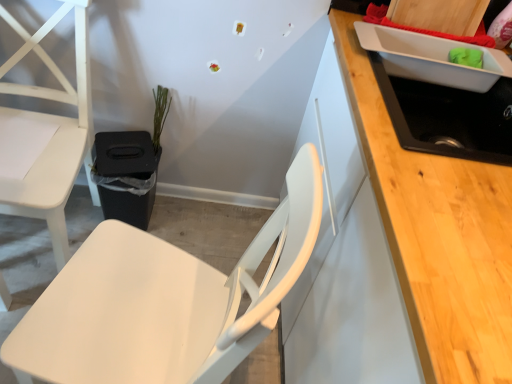
Find the location of a particular element. The image size is (512, 384). white matte chair at left, which is counted as the first chair, starting from the left is located at coordinates 53,136.

What do you see at coordinates (164, 301) in the screenshot? I see `matte white chair at center, acting as the 2th chair starting from the left` at bounding box center [164, 301].

The height and width of the screenshot is (384, 512). What do you see at coordinates (160, 114) in the screenshot? I see `green matte plant at center` at bounding box center [160, 114].

I want to click on white matte chair at left, the second chair positioned from the right, so click(53, 136).

From the image's perspective, is matte white chair at center, acting as the 2th chair starting from the left, positioned above or below white matte chair at left, the second chair positioned from the right?

Clearly, from the image's perspective, matte white chair at center, acting as the 2th chair starting from the left, is below white matte chair at left, the second chair positioned from the right.

Is matte white chair at center, acting as the 2th chair starting from the left, oriented away from white matte chair at left, the second chair positioned from the right?

That's not correct — matte white chair at center, acting as the 2th chair starting from the left, is not looking away from white matte chair at left, the second chair positioned from the right.

Considering the relative positions of matte white chair at center, which is counted as the 1th chair, starting from the right, and white matte chair at left, the second chair positioned from the right, in the image provided, is matte white chair at center, which is counted as the 1th chair, starting from the right, to the left of white matte chair at left, the second chair positioned from the right, from the viewer's perspective?

In fact, matte white chair at center, which is counted as the 1th chair, starting from the right, is to the right of white matte chair at left, the second chair positioned from the right.

Is matte white chair at center, acting as the 2th chair starting from the left, directly adjacent to white matte chair at left, which is counted as the first chair, starting from the left?

No, matte white chair at center, acting as the 2th chair starting from the left, is not with white matte chair at left, which is counted as the first chair, starting from the left.

Considering the points (16, 93) and (129, 364), which point is behind, point (16, 93) or point (129, 364)?

The point (16, 93) is more distant.

From the image's perspective, who appears lower, white matte chair at left, the second chair positioned from the right, or matte white chair at center, acting as the 2th chair starting from the left?

matte white chair at center, acting as the 2th chair starting from the left, from the image's perspective.

Is white matte chair at left, the second chair positioned from the right, further to the viewer compared to matte white chair at center, acting as the 2th chair starting from the left?

Yes, white matte chair at left, the second chair positioned from the right, is further from the camera.

The width and height of the screenshot is (512, 384). What are the coordinates of `sink above the green matte plant at center (from a real-world perspective)` in the screenshot? It's located at (440, 95).

Does black matte sink at upper right have a larger size compared to green matte plant at center?

Indeed, black matte sink at upper right has a larger size compared to green matte plant at center.

Which is in front, black matte sink at upper right or green matte plant at center?

black matte sink at upper right is closer to the camera.

From the image's perspective, is black matte sink at upper right located beneath green matte plant at center?

Yes, from the image's perspective, black matte sink at upper right is beneath green matte plant at center.

Is matte white chair at center, acting as the 2th chair starting from the left, placed right next to green matte plant at center?

No, matte white chair at center, acting as the 2th chair starting from the left, is not touching green matte plant at center.

Considering the relative sizes of matte white chair at center, which is counted as the 1th chair, starting from the right, and green matte plant at center in the image provided, is matte white chair at center, which is counted as the 1th chair, starting from the right, smaller than green matte plant at center?

No, matte white chair at center, which is counted as the 1th chair, starting from the right, is not smaller than green matte plant at center.

Does matte white chair at center, acting as the 2th chair starting from the left, have a lesser width compared to green matte plant at center?

No, matte white chair at center, acting as the 2th chair starting from the left, is not thinner than green matte plant at center.

Measure the distance between matte white chair at center, which is counted as the 1th chair, starting from the right, and green matte plant at center.

A distance of 81.42 centimeters exists between matte white chair at center, which is counted as the 1th chair, starting from the right, and green matte plant at center.

Relative to black matte sink at upper right, is green matte plant at center in front or behind?

green matte plant at center is behind black matte sink at upper right.

Locate an element on the screen. This screenshot has width=512, height=384. plant above the black matte sink at upper right (from the image's perspective) is located at coordinates (160, 114).

From the image's perspective, between green matte plant at center and black matte sink at upper right, which one is located above?

From the image's view, green matte plant at center is above.

Is green matte plant at center facing away from black matte sink at upper right?

No.

Between point (465, 76) and point (52, 173), which one is positioned behind?

The point (52, 173) is farther.

From the image's perspective, is black matte sink at upper right over white matte chair at left, which is counted as the first chair, starting from the left?

Yes, from the image's perspective, black matte sink at upper right is above white matte chair at left, which is counted as the first chair, starting from the left.

From a real-world perspective, which is physically above, black matte sink at upper right or white matte chair at left, which is counted as the first chair, starting from the left?

From a 3D spatial view, black matte sink at upper right is above.

Is black matte sink at upper right facing towards matte white chair at center, acting as the 2th chair starting from the left?

No, black matte sink at upper right is not turned towards matte white chair at center, acting as the 2th chair starting from the left.

Who is more distant, black matte sink at upper right or matte white chair at center, which is counted as the 1th chair, starting from the right?

black matte sink at upper right is more distant.

From the image's perspective, is black matte sink at upper right above matte white chair at center, acting as the 2th chair starting from the left?

Yes.

How far apart are black matte sink at upper right and matte white chair at center, which is counted as the 1th chair, starting from the right?

black matte sink at upper right and matte white chair at center, which is counted as the 1th chair, starting from the right, are 22.38 inches apart from each other.

Where is `chair lying on the right of white matte chair at left, the second chair positioned from the right`? The image size is (512, 384). chair lying on the right of white matte chair at left, the second chair positioned from the right is located at coordinates [x=164, y=301].

Find the location of `chair above the matte white chair at center, which is counted as the 1th chair, starting from the right (from the image's perspective)`. chair above the matte white chair at center, which is counted as the 1th chair, starting from the right (from the image's perspective) is located at coordinates (53, 136).

When comparing their distances from matte white chair at center, acting as the 2th chair starting from the left, does white matte chair at left, the second chair positioned from the right, or green matte plant at center seem further?

green matte plant at center is positioned further to the anchor matte white chair at center, acting as the 2th chair starting from the left.

When comparing their distances from white matte chair at left, the second chair positioned from the right, does black matte sink at upper right or green matte plant at center seem closer?

green matte plant at center.

When comparing their distances from white matte chair at left, which is counted as the first chair, starting from the left, does matte white chair at center, which is counted as the 1th chair, starting from the right, or black matte sink at upper right seem further?

black matte sink at upper right lies further to white matte chair at left, which is counted as the first chair, starting from the left, than the other object.

Consider the image. Looking at the image, which one is located closer to green matte plant at center, black matte sink at upper right or matte white chair at center, which is counted as the 1th chair, starting from the right?

matte white chair at center, which is counted as the 1th chair, starting from the right, is positioned closer to the anchor green matte plant at center.

Which object lies further to the anchor point black matte sink at upper right, green matte plant at center or matte white chair at center, which is counted as the 1th chair, starting from the right?

The object further to black matte sink at upper right is green matte plant at center.

Looking at the image, which one is located closer to white matte chair at left, the second chair positioned from the right, black matte sink at upper right or matte white chair at center, acting as the 2th chair starting from the left?

matte white chair at center, acting as the 2th chair starting from the left.

When comparing their distances from black matte sink at upper right, does matte white chair at center, which is counted as the 1th chair, starting from the right, or green matte plant at center seem closer?

matte white chair at center, which is counted as the 1th chair, starting from the right, lies closer to black matte sink at upper right than the other object.

From the image, which object appears to be farther from black matte sink at upper right, green matte plant at center or white matte chair at left, which is counted as the first chair, starting from the left?

white matte chair at left, which is counted as the first chair, starting from the left, is further to black matte sink at upper right.

In order to click on plant between white matte chair at left, which is counted as the first chair, starting from the left, and black matte sink at upper right from left to right in this screenshot , I will do `click(160, 114)`.

At what (x,y) coordinates should I click in order to perform the action: click on chair between matte white chair at center, which is counted as the 1th chair, starting from the right, and green matte plant at center in the front-back direction. Please return your answer as a coordinate pair (x, y). Looking at the image, I should click on (53, 136).

Identify the location of chair situated between green matte plant at center and black matte sink at upper right from left to right. The image size is (512, 384). (164, 301).

You are a GUI agent. You are given a task and a screenshot of the screen. Output one action in this format:
    pyautogui.click(x=<x>, y=<y>)
    Task: Click on the chair between white matte chair at left, which is counted as the first chair, starting from the left, and black matte sink at upper right
    The height and width of the screenshot is (384, 512).
    Given the screenshot: What is the action you would take?
    pyautogui.click(x=164, y=301)